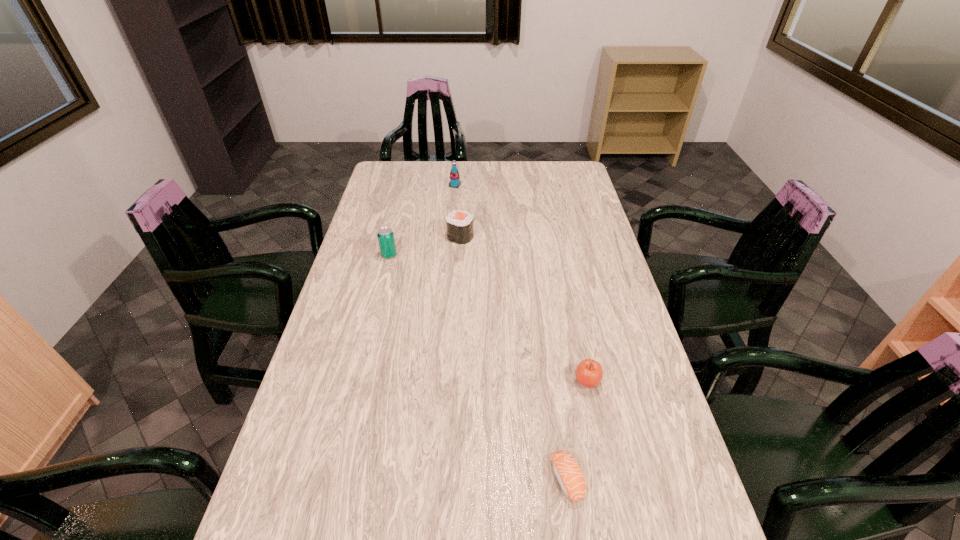
Locate an element on the screen. Image resolution: width=960 pixels, height=540 pixels. blank space located 0.230m on the front of the leftmost object is located at coordinates (376, 308).

Locate an element on the screen. Image resolution: width=960 pixels, height=540 pixels. vacant area situated 0.160m on the front of the second farthest object is located at coordinates (458, 274).

Identify the location of vacant space located on the back of the apple. (569, 299).

Identify the location of vacant space located on the left of the right sushi. (475, 479).

The width and height of the screenshot is (960, 540). Identify the location of object positioned at the far edge. (454, 182).

Locate an element on the screen. The width and height of the screenshot is (960, 540). object that is at the left edge is located at coordinates (385, 235).

I want to click on object at the right edge, so click(589, 373).

In the image, there is a desktop. Identify the location of vacant space at the far edge. The width and height of the screenshot is (960, 540). (434, 165).

Identify the location of vacant space at the left edge of the desktop. The height and width of the screenshot is (540, 960). (332, 381).

This screenshot has height=540, width=960. What are the coordinates of `vacant area at the right edge of the desktop` in the screenshot? It's located at (573, 228).